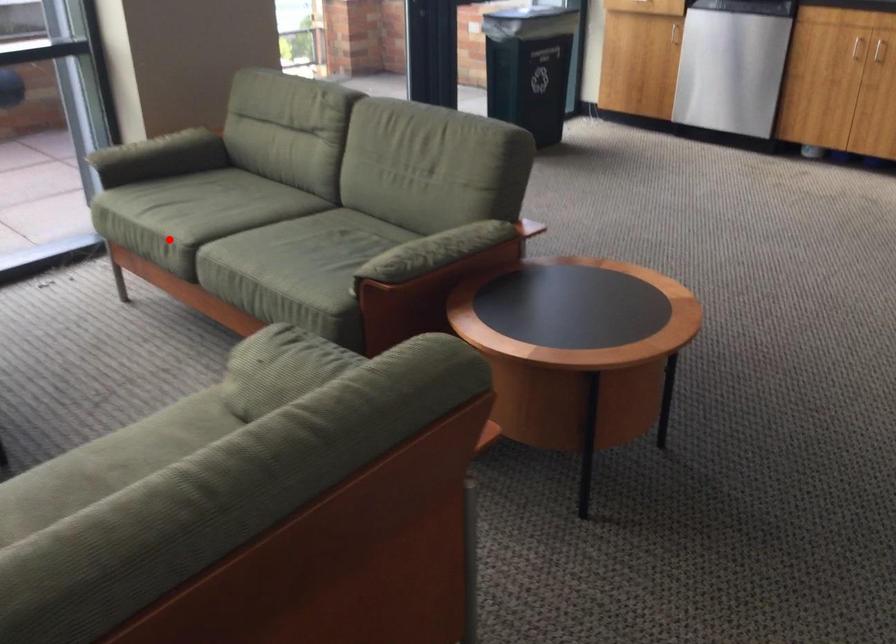
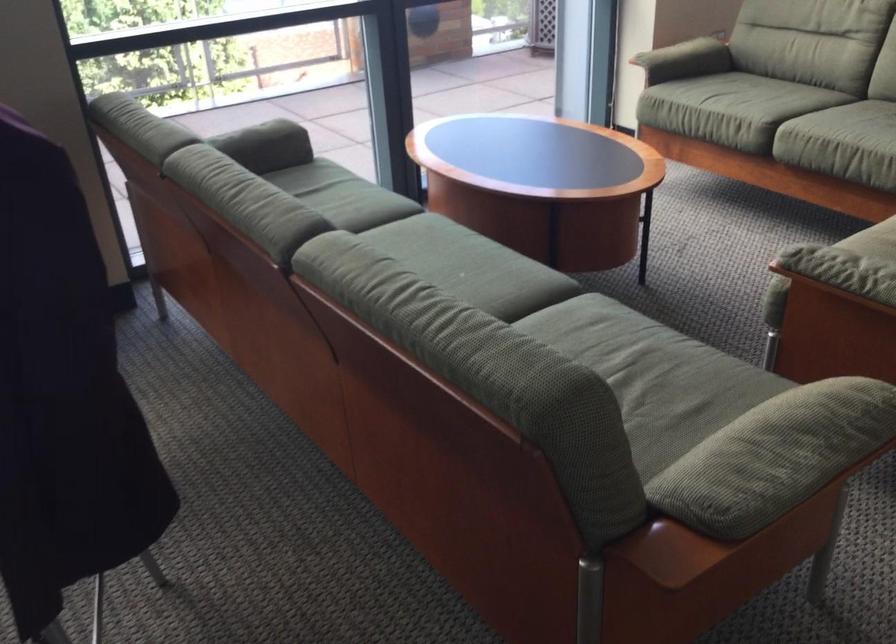
Locate, in the second image, the point that corresponds to the highlighted location in the first image.

(751, 111)